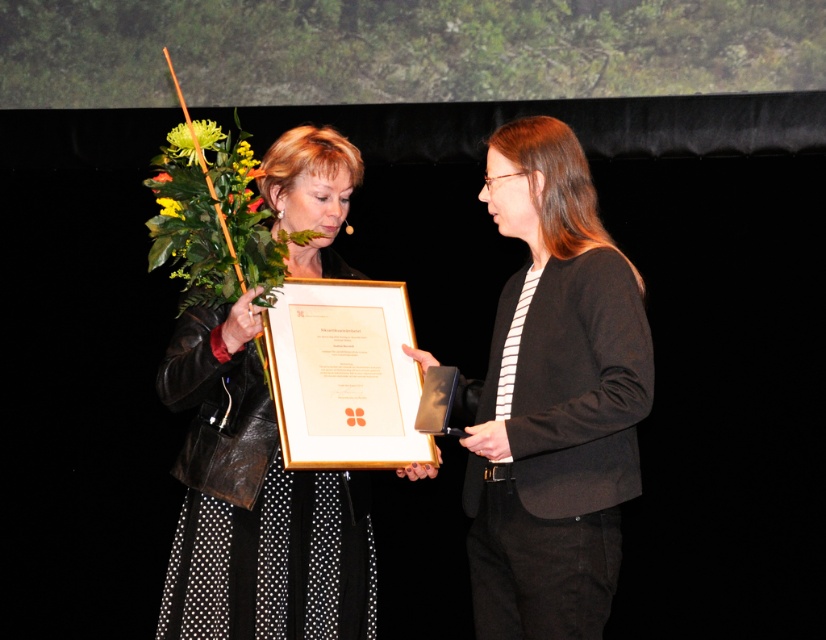
Question: Which point is farther to the camera?

Choices:
 (A) (497, 157)
 (B) (250, 211)
 (C) (188, 125)
 (D) (174, 202)

Answer: (C)

Question: Is black matte blazer at center below leather jacket at center?

Choices:
 (A) no
 (B) yes

Answer: (A)

Question: Based on their relative distances, which object is farther from the green leafy bouquet at upper left?

Choices:
 (A) green leafy bouquet at center
 (B) leather jacket at center
 (C) yellow matte flower at upper left

Answer: (B)

Question: Which object appears closest to the camera in this image?

Choices:
 (A) leather jacket at center
 (B) green leafy bouquet at upper left
 (C) green leafy bouquet at center
 (D) black matte blazer at center

Answer: (D)

Question: Does yellow matte flower at upper left have a smaller size compared to green leafy bouquet at upper left?

Choices:
 (A) yes
 (B) no

Answer: (B)

Question: Is black matte blazer at center above leather jacket at center?

Choices:
 (A) no
 (B) yes

Answer: (B)